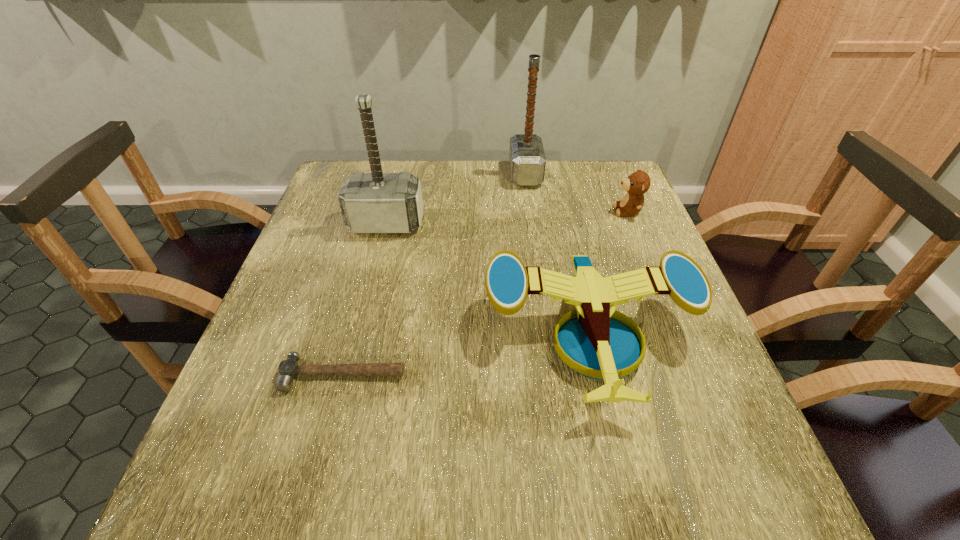
Locate an element on the screen. The width and height of the screenshot is (960, 540). free space located 0.290m for striking with the head of the second farthest hammer is located at coordinates (360, 328).

You are a GUI agent. You are given a task and a screenshot of the screen. Output one action in this format:
    pyautogui.click(x=<x>, y=<y>)
    Task: Click on the free space located at the cockpit of the drone
    The width and height of the screenshot is (960, 540).
    Given the screenshot: What is the action you would take?
    pyautogui.click(x=624, y=485)

This screenshot has width=960, height=540. What are the coordinates of `free spot located 0.080m on the face of the teddy bear` in the screenshot? It's located at (585, 211).

You are a GUI agent. You are given a task and a screenshot of the screen. Output one action in this format:
    pyautogui.click(x=<x>, y=<y>)
    Task: Click on the vacant space located on the face of the teddy bear
    The width and height of the screenshot is (960, 540).
    Given the screenshot: What is the action you would take?
    pyautogui.click(x=562, y=211)

I want to click on vacant space located on the face of the teddy bear, so click(x=569, y=211).

You are a GUI agent. You are given a task and a screenshot of the screen. Output one action in this format:
    pyautogui.click(x=<x>, y=<y>)
    Task: Click on the free space located on the striking face of the shortest hammer
    
    Given the screenshot: What is the action you would take?
    pyautogui.click(x=330, y=424)

This screenshot has height=540, width=960. Identify the location of hammer positioned at the far edge. (527, 160).

Where is `teddy bear present at the far edge`? Image resolution: width=960 pixels, height=540 pixels. teddy bear present at the far edge is located at coordinates (638, 183).

Locate an element on the screen. drone at the right edge is located at coordinates (593, 344).

At what (x,y) coordinates should I click in order to perform the action: click on teddy bear located in the right edge section of the desktop. Please return your answer as a coordinate pair (x, y). This screenshot has height=540, width=960. Looking at the image, I should click on (638, 183).